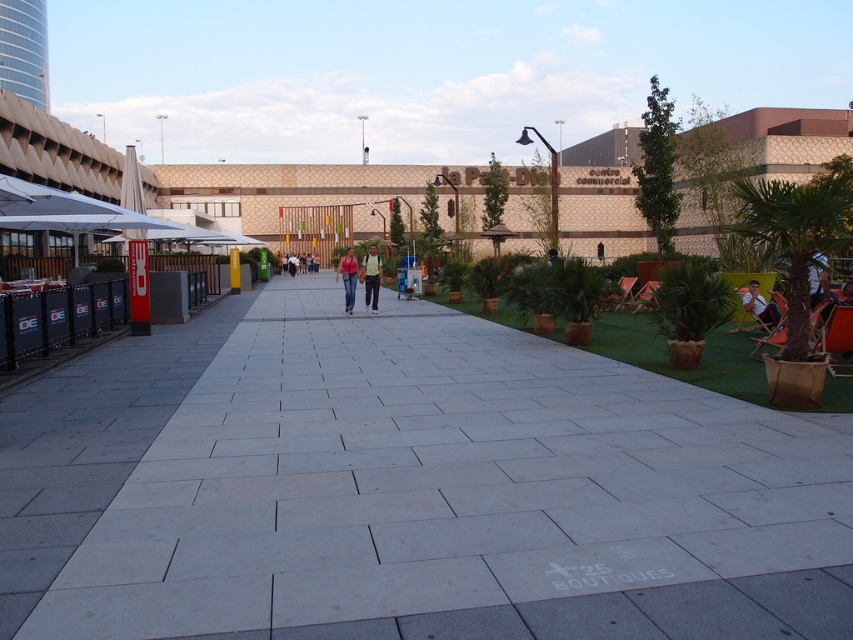
You need to place a new bench that is 1.5 meters wide in this area. Given the gray concrete pavement at center and the white fabric chair at right, which object would be more suitable for placing the bench next to without exceeding its width?

The gray concrete pavement at center has a larger width than the white fabric chair at right, so placing the bench next to the gray concrete pavement at center would be more suitable as it can accommodate the bench without exceeding its width.

You are standing on the walkway and want to sit on one of the chairs at the right side. Which chair would be closer to you, the light brown leather chair at right or the white fabric chair at right?

The light brown leather chair at right is closer to you because it is positioned further to the viewer than the white fabric chair at right.

You are standing at the point with coordinates point (827,298) and want to walk to the point with coordinates point (293,627). Which direction should you move relative to your current position?

You should move forward because point (293,627) is in front of point (827,298).